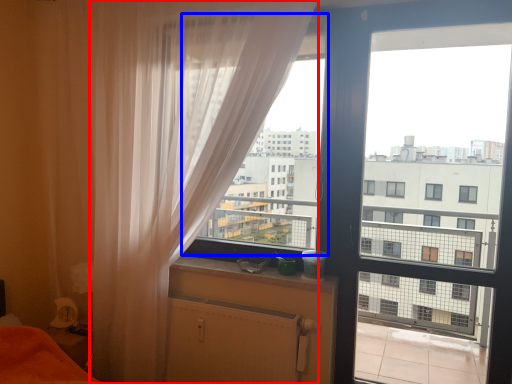
Question: Which point is further to the camera, curtain (highlighted by a red box) or window screen (highlighted by a blue box)?

Choices:
 (A) curtain
 (B) window screen

Answer: (B)